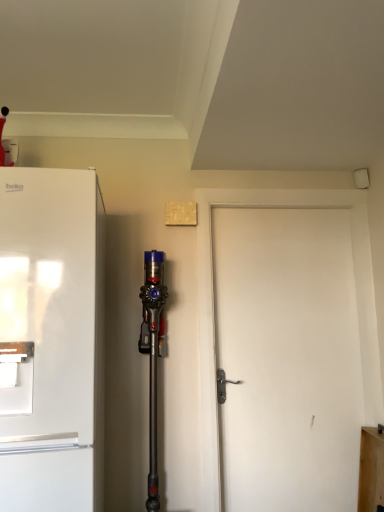
Question: Is the depth of white matte refrigerator at left less than that of white matte door at center?

Choices:
 (A) no
 (B) yes

Answer: (B)

Question: From the image's perspective, is white matte refrigerator at left below white matte door at center?

Choices:
 (A) yes
 (B) no

Answer: (B)

Question: Is white matte refrigerator at left looking in the opposite direction of white matte door at center?

Choices:
 (A) no
 (B) yes

Answer: (A)

Question: Would you consider white matte refrigerator at left to be distant from white matte door at center?

Choices:
 (A) yes
 (B) no

Answer: (A)

Question: Is white matte refrigerator at left to the left of white matte door at center from the viewer's perspective?

Choices:
 (A) yes
 (B) no

Answer: (A)

Question: Does white matte refrigerator at left have a smaller size compared to white matte door at center?

Choices:
 (A) no
 (B) yes

Answer: (A)

Question: Are white matte door at center and white matte refrigerator at left far apart?

Choices:
 (A) no
 (B) yes

Answer: (B)

Question: Can you confirm if white matte door at center is thinner than white matte refrigerator at left?

Choices:
 (A) yes
 (B) no

Answer: (A)

Question: Considering the relative sizes of white matte door at center and white matte refrigerator at left in the image provided, is white matte door at center shorter than white matte refrigerator at left?

Choices:
 (A) no
 (B) yes

Answer: (A)

Question: From a real-world perspective, is white matte door at center under white matte refrigerator at left?

Choices:
 (A) yes
 (B) no

Answer: (A)

Question: Are white matte door at center and white matte refrigerator at left beside each other?

Choices:
 (A) no
 (B) yes

Answer: (A)

Question: From the image's perspective, is white matte door at center above white matte refrigerator at left?

Choices:
 (A) yes
 (B) no

Answer: (B)

Question: Looking at their shapes, would you say white matte door at center is wider or thinner than white matte refrigerator at left?

Choices:
 (A) wide
 (B) thin

Answer: (B)